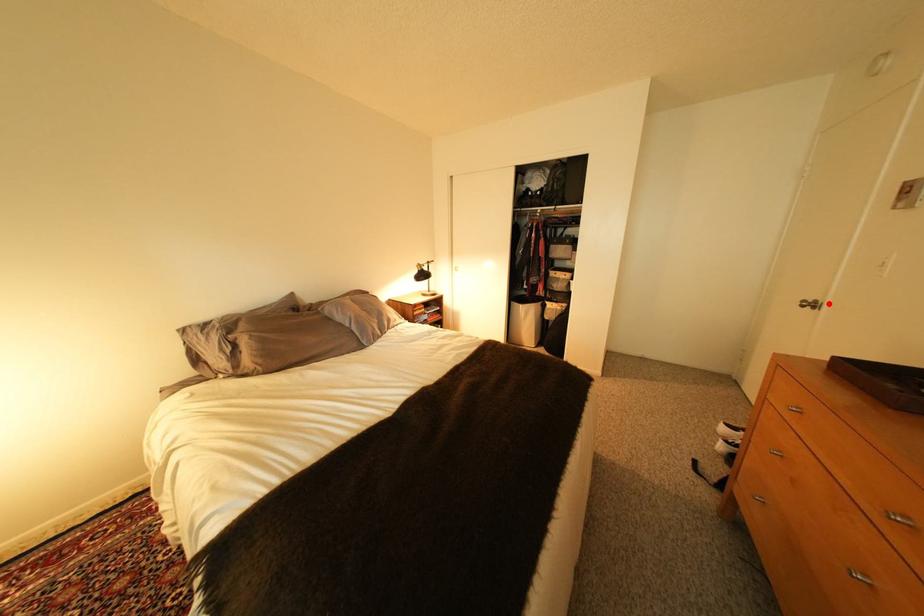
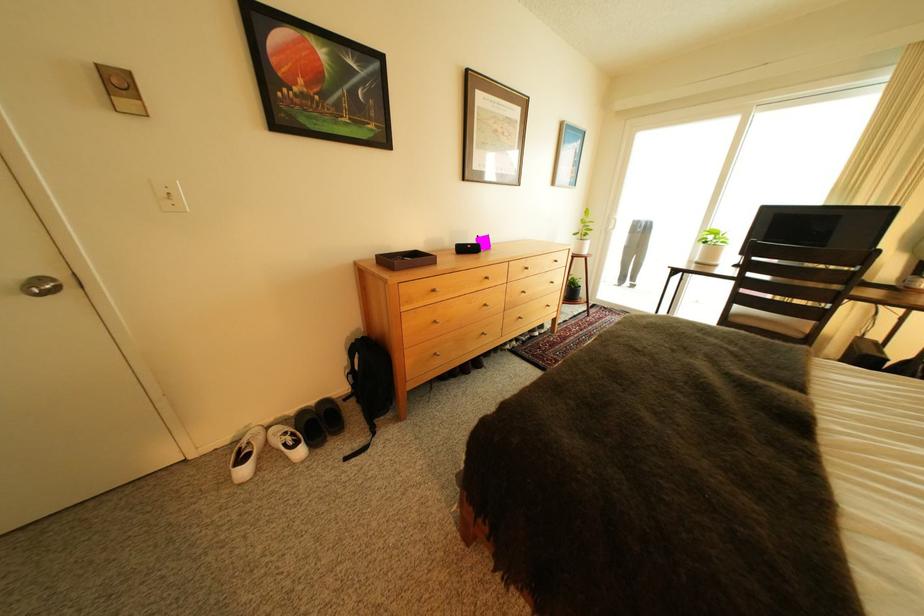
Question: I am providing you with two images of the same scene from different viewpoints. A red point is shown in image1. For the corresponding object point in image2, is it positioned nearer or farther from the camera?

Choices:
 (A) Nearer
 (B) Farther

Answer: (A)